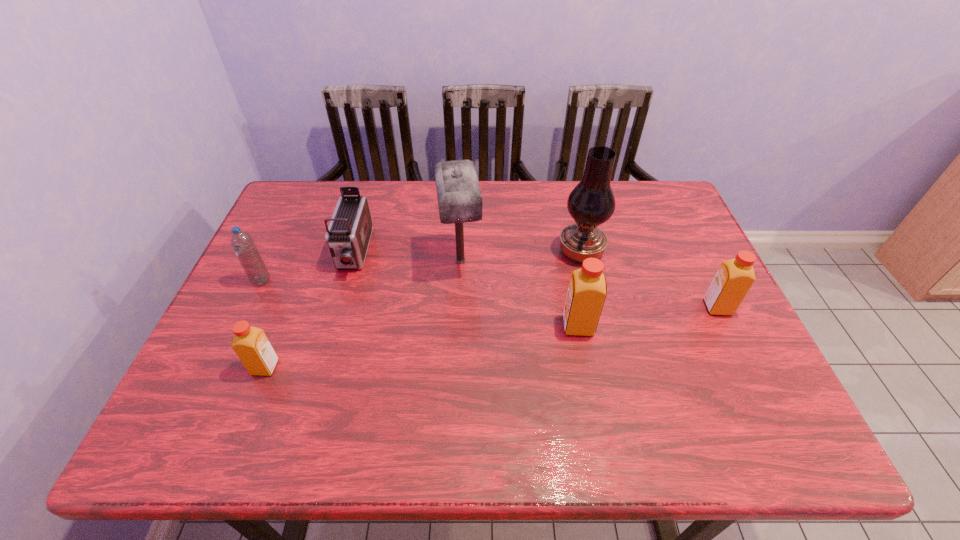
Where is `object at the right edge`? This screenshot has height=540, width=960. object at the right edge is located at coordinates (734, 278).

This screenshot has height=540, width=960. In order to click on object that is at the near left corner in this screenshot , I will do `click(251, 345)`.

I want to click on vacant point at the far edge, so click(x=496, y=202).

In the image, there is a desktop. At what (x,y) coordinates should I click in order to perform the action: click on free space at the near edge. Please return your answer as a coordinate pair (x, y). This screenshot has height=540, width=960. Looking at the image, I should click on (594, 377).

The width and height of the screenshot is (960, 540). I want to click on blank area at the left edge, so click(261, 247).

This screenshot has width=960, height=540. In order to click on free point at the right edge in this screenshot , I will do 734,321.

In the image, there is a desktop. Identify the location of vacant area at the near right corner. The width and height of the screenshot is (960, 540). (700, 395).

Identify the location of empty space between the oil lamp and the nearest object. pos(422,310).

Locate an element on the screen. This screenshot has height=540, width=960. free spot between the third object from left to right and the second object from left to right is located at coordinates (309, 310).

Identify the location of unoccupied position between the fifth object from right to left and the rightmost object. (536, 280).